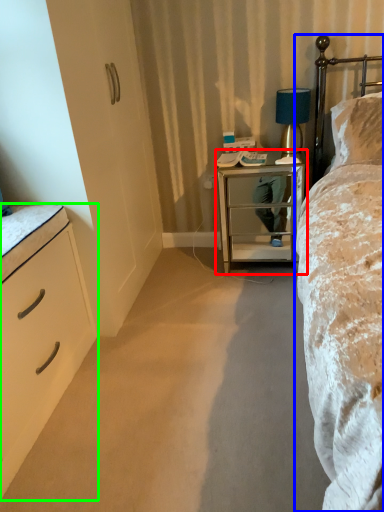
Question: Based on their relative distances, which object is nearer to nightstand (highlighted by a red box)? Choose from bed (highlighted by a blue box) and chest of drawers (highlighted by a green box).

Choices:
 (A) bed
 (B) chest of drawers

Answer: (A)